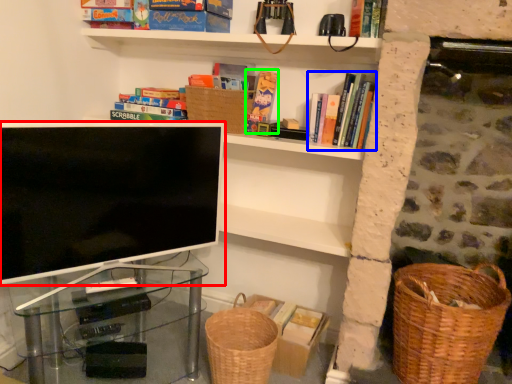
Question: Which object is the farthest from television (highlighted by a red box)? Choose among these: book (highlighted by a blue box) or book (highlighted by a green box).

Choices:
 (A) book
 (B) book

Answer: (A)